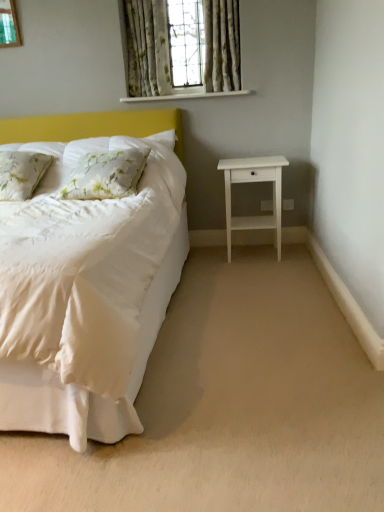
Image resolution: width=384 pixels, height=512 pixels. What do you see at coordinates (222, 45) in the screenshot?
I see `floral fabric curtain at upper center, the 2th curtain viewed from the left` at bounding box center [222, 45].

The height and width of the screenshot is (512, 384). In order to click on white matte nightstand at right in this screenshot , I will do `click(254, 182)`.

This screenshot has width=384, height=512. What do you see at coordinates (21, 173) in the screenshot? I see `floral fabric pillow at left, the first pillow positioned from the left` at bounding box center [21, 173].

In order to face floral fabric pillow at left, marked as the second pillow in a left-to-right arrangement, should I rotate leftwards or rightwards?

Rotate left and turn 11.522 degrees.

Describe the element at coordinates (105, 175) in the screenshot. I see `floral fabric pillow at left, arranged as the first pillow when viewed from the right` at that location.

Image resolution: width=384 pixels, height=512 pixels. What do you see at coordinates (229, 405) in the screenshot?
I see `beige carpet at lower center` at bounding box center [229, 405].

Measure the distance between beige carpet at lower center and camera.

beige carpet at lower center and camera are 1.15 meters apart from each other.

Where is `floral fabric curtain at upper center, which is the first curtain in right-to-left order`? The width and height of the screenshot is (384, 512). floral fabric curtain at upper center, which is the first curtain in right-to-left order is located at coordinates (222, 45).

From their relative heights in the image, would you say green floral curtains at upper center is taller or shorter than floral fabric pillow at left, the first pillow positioned from the left?

Considering their sizes, green floral curtains at upper center has more height than floral fabric pillow at left, the first pillow positioned from the left.

Where is `window located above the floral fabric pillow at left, marked as the 2th pillow in a right-to-left arrangement (from the image's perspective)`? window located above the floral fabric pillow at left, marked as the 2th pillow in a right-to-left arrangement (from the image's perspective) is located at coordinates coord(148,48).

Between green floral curtains at upper center and floral fabric pillow at left, the first pillow positioned from the left, which one appears on the right side from the viewer's perspective?

Positioned to the right is green floral curtains at upper center.

How many degrees apart are the facing directions of green floral curtains at upper center and floral fabric pillow at left, marked as the 2th pillow in a right-to-left arrangement?

3.19 degrees.

Locate an element on the screen. The height and width of the screenshot is (512, 384). the 1st curtain directly above the floral fabric pillow at left, arranged as the first pillow when viewed from the right (from a real-world perspective) is located at coordinates (222, 45).

Is floral fabric pillow at left, arranged as the first pillow when viewed from the right, in contact with floral fabric curtain at upper center, the 2th curtain viewed from the left?

No, floral fabric pillow at left, arranged as the first pillow when viewed from the right, is not with floral fabric curtain at upper center, the 2th curtain viewed from the left.

How distant is floral fabric pillow at left, marked as the second pillow in a left-to-right arrangement, from floral fabric curtain at upper center, the 2th curtain viewed from the left?

They are 3.77 feet apart.

Considering the sizes of objects beige carpet at lower center and white matte nightstand at right in the image provided, who is thinner, beige carpet at lower center or white matte nightstand at right?

white matte nightstand at right.

Are beige carpet at lower center and white matte nightstand at right beside each other?

beige carpet at lower center and white matte nightstand at right are clearly separated.

Could you tell me if beige carpet at lower center is turned towards white matte nightstand at right?

No, beige carpet at lower center does not turn towards white matte nightstand at right.

Which object is closer to the camera taking this photo, floral fabric curtain at upper center, placed as the 2th curtain when sorted from right to left, or beige carpet at lower center?

beige carpet at lower center is more forward.

Is floral fabric curtain at upper center, marked as the 1th curtain in a left-to-right arrangement, not within beige carpet at lower center?

Indeed, floral fabric curtain at upper center, marked as the 1th curtain in a left-to-right arrangement, is completely outside beige carpet at lower center.

In terms of size, does floral fabric curtain at upper center, marked as the 1th curtain in a left-to-right arrangement, appear bigger or smaller than beige carpet at lower center?

In the image, floral fabric curtain at upper center, marked as the 1th curtain in a left-to-right arrangement, appears to be smaller than beige carpet at lower center.

Is point (144, 398) positioned before point (168, 100)?

Yes, point (144, 398) is closer to viewer.

Based on the photo, which is in front, beige carpet at lower center or white painted wood at upper center?

beige carpet at lower center is more forward.

Identify the location of window sill that appears above the beige carpet at lower center (from the image's perspective). This screenshot has height=512, width=384. (187, 96).

Is beige carpet at lower center facing away from white painted wood at upper center?

beige carpet at lower center is not turned away from white painted wood at upper center.

Does point (252, 262) come in front of point (212, 59)?

Yes, point (252, 262) is closer to viewer.

Is beige carpet at lower center thinner than floral fabric curtain at upper center, which is the first curtain in right-to-left order?

No.

Is there a large distance between beige carpet at lower center and floral fabric curtain at upper center, the 2th curtain viewed from the left?

Yes, beige carpet at lower center is far from floral fabric curtain at upper center, the 2th curtain viewed from the left.

Does beige carpet at lower center lie behind floral fabric curtain at upper center, which is the first curtain in right-to-left order?

No, the depth of beige carpet at lower center is less than that of floral fabric curtain at upper center, which is the first curtain in right-to-left order.

Could you tell me if floral fabric pillow at left, the first pillow positioned from the left, is turned towards green floral curtains at upper center?

No, floral fabric pillow at left, the first pillow positioned from the left, is not facing towards green floral curtains at upper center.

From a real-world perspective, is floral fabric pillow at left, marked as the 2th pillow in a right-to-left arrangement, below green floral curtains at upper center?

Yes.

Considering the positions of points (30, 167) and (127, 9), is point (30, 167) closer to camera compared to point (127, 9)?

Yes, it is in front of point (127, 9).

Is floral fabric pillow at left, the first pillow positioned from the left, in front of green floral curtains at upper center?

Yes.

Locate an element on the screen. This screenshot has width=384, height=512. the 1st pillow in front of the green floral curtains at upper center, counting from the anchor's position is located at coordinates (21, 173).

The height and width of the screenshot is (512, 384). In order to click on the 1st pillow to the left when counting from the floral fabric curtain at upper center, which is the first curtain in right-to-left order in this screenshot , I will do `click(105, 175)`.

Considering their positions, is floral fabric curtain at upper center, marked as the 1th curtain in a left-to-right arrangement, positioned further to white matte nightstand at right than floral fabric pillow at left, the first pillow positioned from the left?

floral fabric pillow at left, the first pillow positioned from the left.

From the image, which object appears to be nearer to beige carpet at lower center, floral fabric pillow at left, arranged as the first pillow when viewed from the right, or white matte nightstand at right?

Among the two, floral fabric pillow at left, arranged as the first pillow when viewed from the right, is located nearer to beige carpet at lower center.

Which object lies nearer to the anchor point green floral curtains at upper center, floral fabric pillow at left, the first pillow positioned from the left, or white painted wood at upper center?

The object closer to green floral curtains at upper center is white painted wood at upper center.

Estimate the real-world distances between objects in this image. Which object is closer to white matte nightstand at right, beige carpet at lower center or floral fabric pillow at left, marked as the 2th pillow in a right-to-left arrangement?

Based on the image, beige carpet at lower center appears to be nearer to white matte nightstand at right.

When comparing their distances from floral fabric pillow at left, the first pillow positioned from the left, does beige carpet at lower center or floral fabric curtain at upper center, the 2th curtain viewed from the left, seem further?

beige carpet at lower center lies further to floral fabric pillow at left, the first pillow positioned from the left, than the other object.

In the scene shown: Considering their positions, is floral fabric curtain at upper center, placed as the 2th curtain when sorted from right to left, positioned closer to beige carpet at lower center than floral fabric pillow at left, marked as the second pillow in a left-to-right arrangement?

floral fabric pillow at left, marked as the second pillow in a left-to-right arrangement, is closer to beige carpet at lower center.

Consider the image. Based on their spatial positions, is white painted wood at upper center or green floral curtains at upper center further from white matte nightstand at right?

green floral curtains at upper center.

Looking at the image, which one is located closer to floral fabric curtain at upper center, the 2th curtain viewed from the left, white painted wood at upper center or floral fabric pillow at left, marked as the 2th pillow in a right-to-left arrangement?

white painted wood at upper center is positioned closer to the anchor floral fabric curtain at upper center, the 2th curtain viewed from the left.

Identify the location of window located between beige carpet at lower center and white painted wood at upper center in the depth direction. This screenshot has height=512, width=384. (148, 48).

You are a GUI agent. You are given a task and a screenshot of the screen. Output one action in this format:
    pyautogui.click(x=<x>, y=<y>)
    Task: Click on the window sill between floral fabric curtain at upper center, the 2th curtain viewed from the left, and white matte nightstand at right in the up-down direction
    This screenshot has width=384, height=512.
    Given the screenshot: What is the action you would take?
    pyautogui.click(x=187, y=96)

This screenshot has height=512, width=384. I want to click on pillow between floral fabric pillow at left, marked as the 2th pillow in a right-to-left arrangement, and white matte nightstand at right, in the horizontal direction, so click(x=105, y=175).

Find the location of `window sill between floral fabric pillow at left, marked as the 2th pillow in a right-to-left arrangement, and white matte nightstand at right from left to right`. window sill between floral fabric pillow at left, marked as the 2th pillow in a right-to-left arrangement, and white matte nightstand at right from left to right is located at coordinates [x=187, y=96].